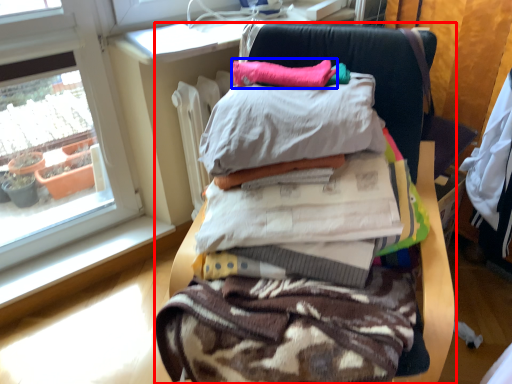
Question: Which point is closer to the camera, furniture (highlighted by a red box) or pillow (highlighted by a blue box)?

Choices:
 (A) furniture
 (B) pillow

Answer: (A)